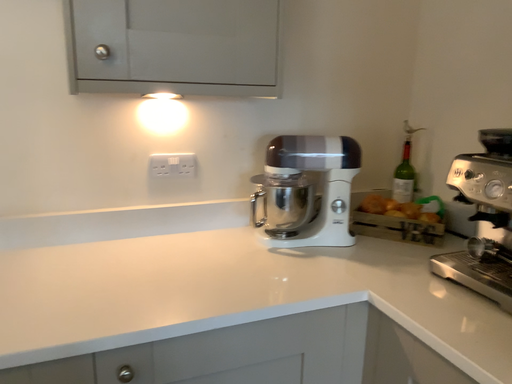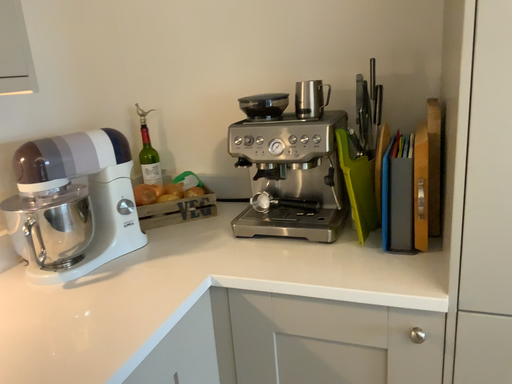
Question: Which way did the camera rotate in the video?

Choices:
 (A) rotated right
 (B) rotated left

Answer: (A)